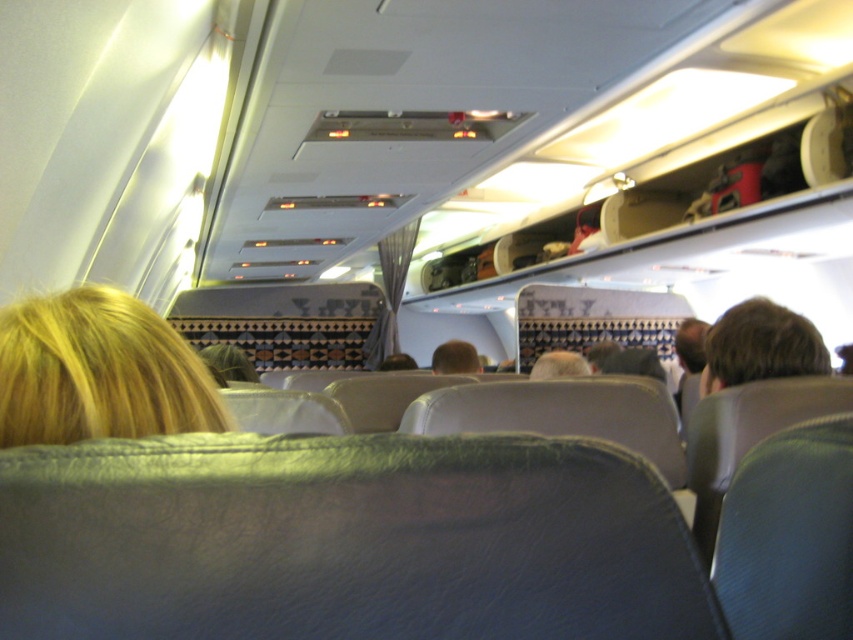
You are sitting in an airplane seat and notice two passengers ahead. One has brown hair at right and the other has blonde hair at center. Which passenger is sitting to the right of the other?

The brown hair at right is to the right of the blonde hair at center.